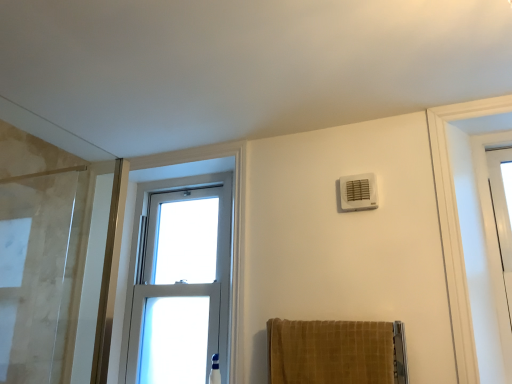
Question: Is clear glass window at center facing away from velvet gold towel at lower center?

Choices:
 (A) yes
 (B) no

Answer: (B)

Question: Can you confirm if clear glass window at center is thinner than velvet gold towel at lower center?

Choices:
 (A) no
 (B) yes

Answer: (B)

Question: Can you confirm if clear glass window at center is shorter than velvet gold towel at lower center?

Choices:
 (A) no
 (B) yes

Answer: (A)

Question: From a real-world perspective, is clear glass window at center physically below velvet gold towel at lower center?

Choices:
 (A) yes
 (B) no

Answer: (B)

Question: From the image's perspective, is clear glass window at center beneath velvet gold towel at lower center?

Choices:
 (A) no
 (B) yes

Answer: (A)

Question: Choose the correct answer: Is velvet gold towel at lower center inside clear glass window at center or outside it?

Choices:
 (A) outside
 (B) inside

Answer: (A)

Question: Based on their positions, is velvet gold towel at lower center located to the left or right of clear glass window at center?

Choices:
 (A) right
 (B) left

Answer: (A)

Question: From the image's perspective, is velvet gold towel at lower center positioned above or below clear glass window at center?

Choices:
 (A) above
 (B) below

Answer: (B)

Question: From their relative heights in the image, would you say velvet gold towel at lower center is taller or shorter than clear glass window at center?

Choices:
 (A) tall
 (B) short

Answer: (B)

Question: Is clear glass window at center taller or shorter than velvet gold towel at lower center?

Choices:
 (A) short
 (B) tall

Answer: (B)

Question: From a real-world perspective, is clear glass window at center physically located above or below velvet gold towel at lower center?

Choices:
 (A) above
 (B) below

Answer: (A)

Question: Considering their positions, is clear glass window at center located in front of or behind velvet gold towel at lower center?

Choices:
 (A) behind
 (B) front

Answer: (A)

Question: Considering the positions of clear glass window at center and velvet gold towel at lower center in the image, is clear glass window at center wider or thinner than velvet gold towel at lower center?

Choices:
 (A) thin
 (B) wide

Answer: (A)

Question: Based on their sizes in the image, would you say clear glass window at center is bigger or smaller than white plastic air conditioning unit at upper right?

Choices:
 (A) big
 (B) small

Answer: (A)

Question: Visually, is clear glass window at center positioned to the left or to the right of white plastic air conditioning unit at upper right?

Choices:
 (A) right
 (B) left

Answer: (B)